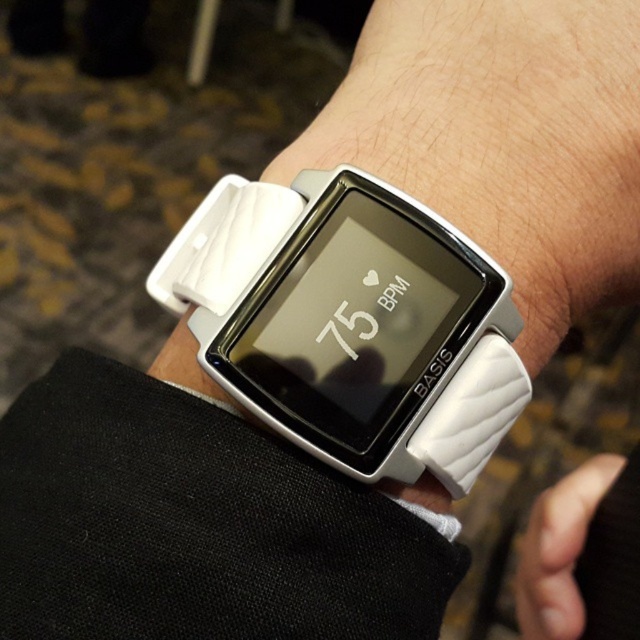
Question: Is white rubber watch at center to the right of white matte wristwatch at center from the viewer's perspective?

Choices:
 (A) yes
 (B) no

Answer: (B)

Question: Can you confirm if white rubber watch at center is positioned above white matte wristwatch at center?

Choices:
 (A) yes
 (B) no

Answer: (A)

Question: Which object appears closest to the camera in this image?

Choices:
 (A) white rubber watch at center
 (B) white matte wristwatch at center

Answer: (A)

Question: Is white rubber watch at center closer to the viewer compared to white matte wristwatch at center?

Choices:
 (A) no
 (B) yes

Answer: (B)

Question: Which of the following is the closest to the observer?

Choices:
 (A) white matte wristwatch at center
 (B) white rubber watch at center

Answer: (B)